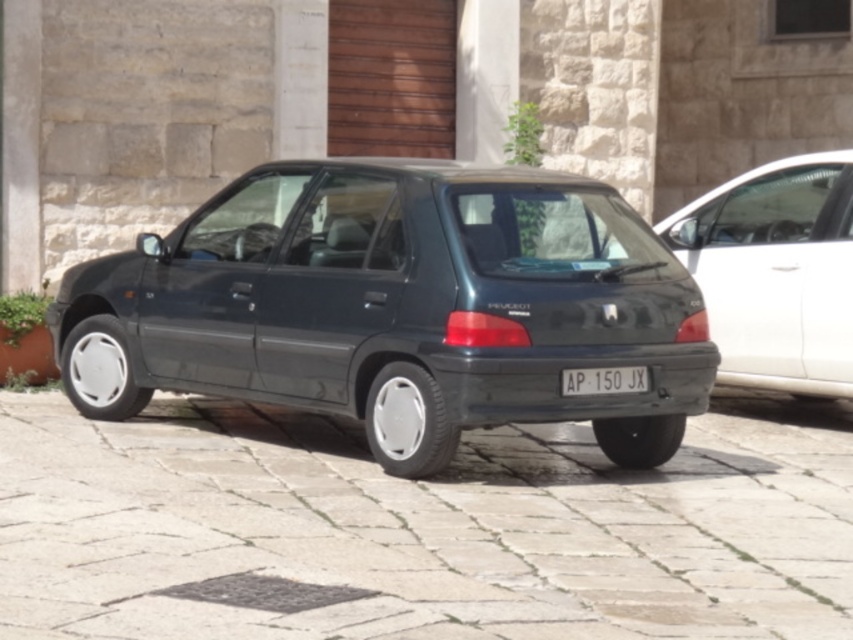
Is gray stone pavement at center smaller than metallic gray hatchback at center?

Correct, gray stone pavement at center occupies less space than metallic gray hatchback at center.

Who is more forward, (804, 608) or (538, 184)?

Point (804, 608) is in front.

Where is `gray stone pavement at center`? gray stone pavement at center is located at coordinates (418, 529).

Between gray stone pavement at center and black plastic license plate at center, which one has less height?

gray stone pavement at center

Does gray stone pavement at center have a greater width compared to black plastic license plate at center?

Correct, the width of gray stone pavement at center exceeds that of black plastic license plate at center.

Consider the image. Who is more distant from viewer, (x=178, y=516) or (x=635, y=371)?

Positioned behind is point (x=635, y=371).

Image resolution: width=853 pixels, height=640 pixels. What are the coordinates of `gray stone pavement at center` in the screenshot? It's located at (418, 529).

Is point (503, 298) farther from viewer compared to point (628, 387)?

That is False.

Consider the image. Does metallic gray hatchback at center appear over black plastic license plate at center?

Indeed, metallic gray hatchback at center is positioned over black plastic license plate at center.

Is point (233, 180) farther from camera compared to point (643, 368)?

Yes.

The image size is (853, 640). I want to click on metallic gray hatchback at center, so pyautogui.click(x=397, y=307).